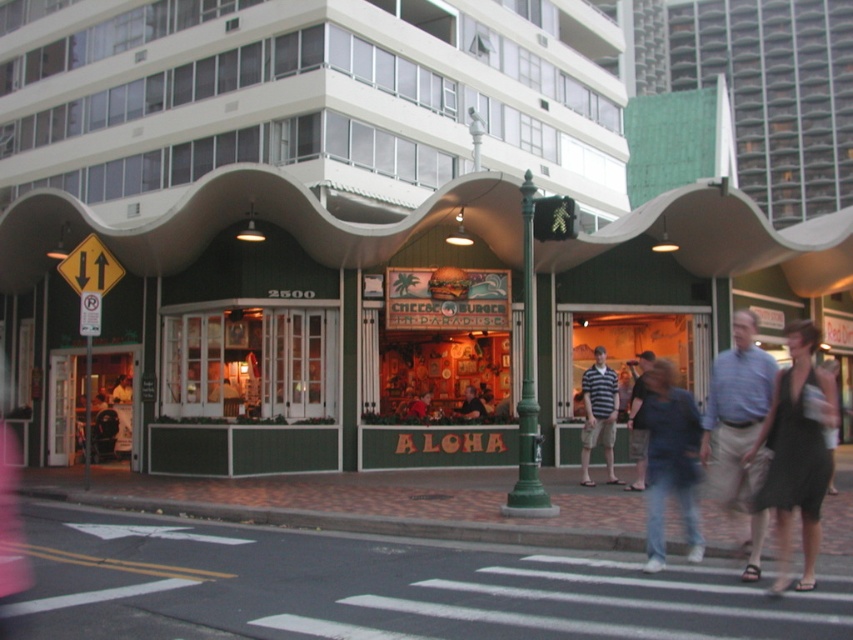
Question: Does black textured dress at lower right appear on the right side of green metal pole at center?

Choices:
 (A) yes
 (B) no

Answer: (B)

Question: Among these objects, which one is nearest to the camera?

Choices:
 (A) striped cotton shirt at center
 (B) green metal pole at center

Answer: (B)

Question: Is denim jeans at lower right wider than green metal pole at center?

Choices:
 (A) no
 (B) yes

Answer: (A)

Question: Is green metal pole at center to the left of striped cotton shirt at center from the viewer's perspective?

Choices:
 (A) yes
 (B) no

Answer: (B)

Question: Which of these objects is positioned closest to the blue shirt at center?

Choices:
 (A) black textured dress at lower right
 (B) striped cotton shirt at center

Answer: (A)

Question: Among these objects, which one is nearest to the camera?

Choices:
 (A) striped cotton shirt at center
 (B) denim jeans at lower right
 (C) blue shirt at center
 (D) green metal pole at center

Answer: (C)